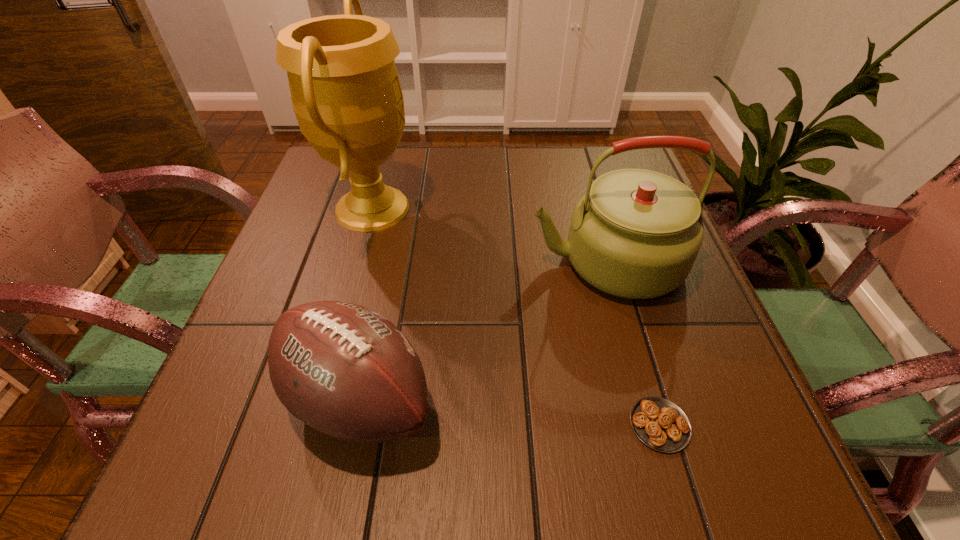
The height and width of the screenshot is (540, 960). I want to click on free spot between the second tallest object and the third tallest object, so click(x=483, y=331).

Locate an element on the screen. This screenshot has height=540, width=960. free space between the pastry and the trophy is located at coordinates click(x=516, y=316).

I want to click on free space between the kettle and the second shortest object, so click(483, 331).

I want to click on empty space that is in between the football (American) and the shortest object, so click(509, 413).

The height and width of the screenshot is (540, 960). Find the location of `free spot between the kettle and the tallest object`. free spot between the kettle and the tallest object is located at coordinates (490, 235).

Identify the location of object that is the second closest to the shortest object. The height and width of the screenshot is (540, 960). (345, 370).

Where is `object that is the third closest one to the second tallest object`? object that is the third closest one to the second tallest object is located at coordinates (346, 95).

At what (x,y) coordinates should I click in order to perform the action: click on blank area in the image that satisfies the following two spatial constraints: 1. on the engravings side of the trophy; 2. on the back side of the football (American). Please return your answer as a coordinate pair (x, y). The image size is (960, 540). Looking at the image, I should click on (319, 400).

This screenshot has height=540, width=960. Find the location of `vacant position in the image that satisfies the following two spatial constraints: 1. at the spout of the second tallest object; 2. on the back side of the shortest object`. vacant position in the image that satisfies the following two spatial constraints: 1. at the spout of the second tallest object; 2. on the back side of the shortest object is located at coordinates (653, 425).

Identify the location of free spot that satisfies the following two spatial constraints: 1. on the back side of the football (American); 2. on the engravings side of the trophy. (398, 208).